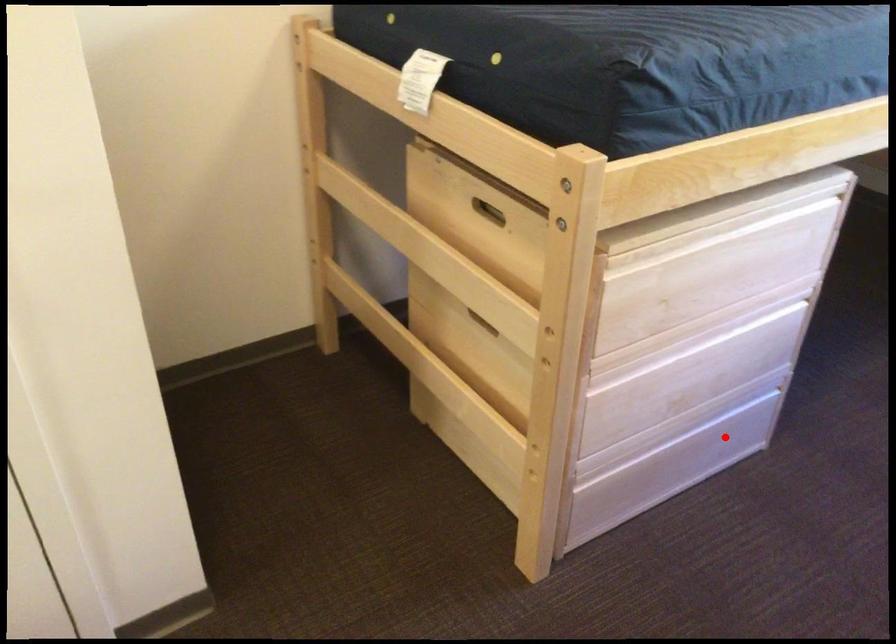
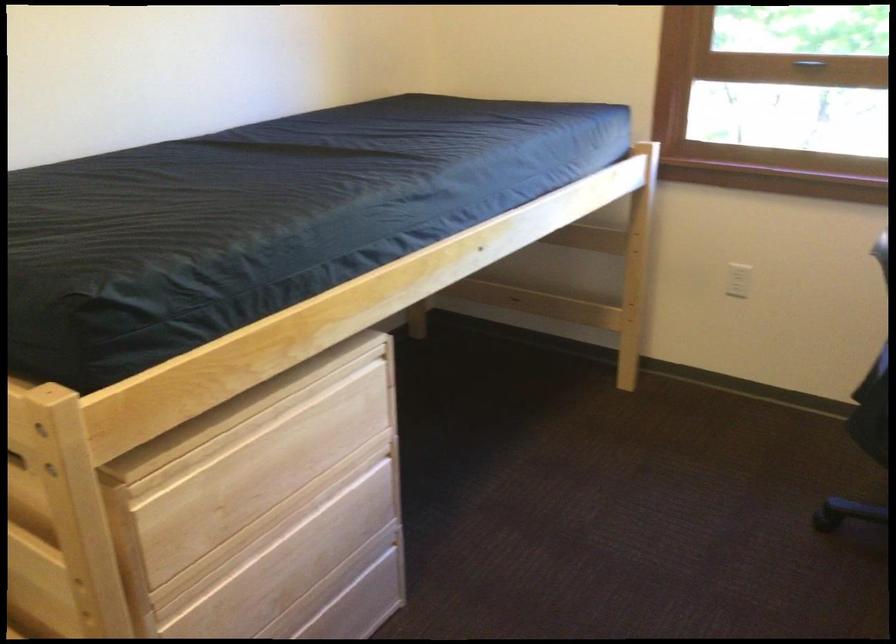
Find the pixel in the second image that matches the highlighted location in the first image.

(354, 611)